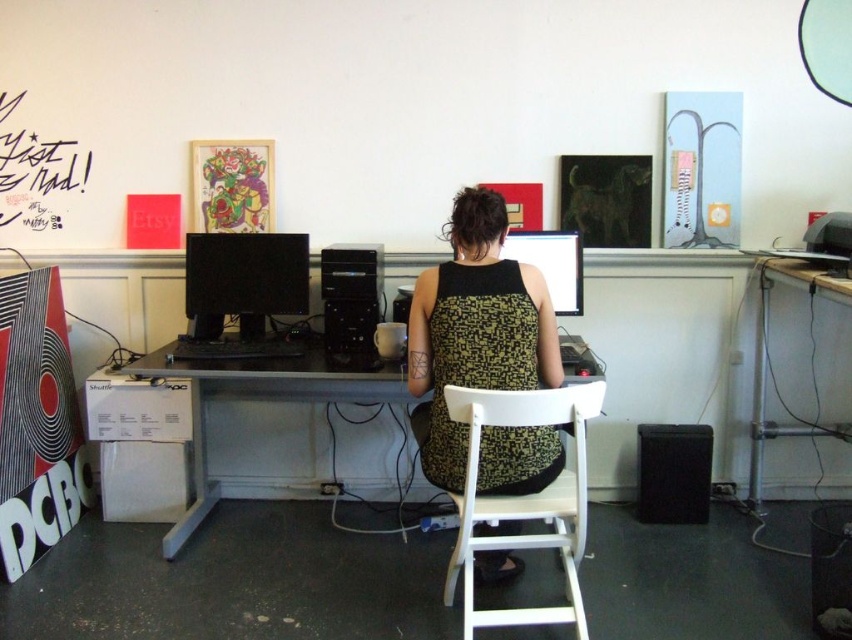
You are setting up a new monitor in an office. The white plastic computer desk at center is where you want to place it. Is the black plastic monitor at center currently placed above or below the desk?

The white plastic computer desk at center is positioned under the black plastic monitor at center, so the monitor is above the desk.

You are setting up a new speaker in the workspace. The black matte speaker at lower right and the metallic silver table at right are both in your view. Which object is smaller?

The black matte speaker at lower right is smaller than the metallic silver table at right.

Consider the image. You need to place a new keyboard that is 1.2 feet wide on the desk. Considering the white plastic computer desk at center and the black plastic monitor at center, will there be enough space on the desk for the keyboard?

The white plastic computer desk at center is bigger than the black plastic monitor at center. Since the desk is larger, there should be sufficient space to place the keyboard provided it is positioned away from the monitor.